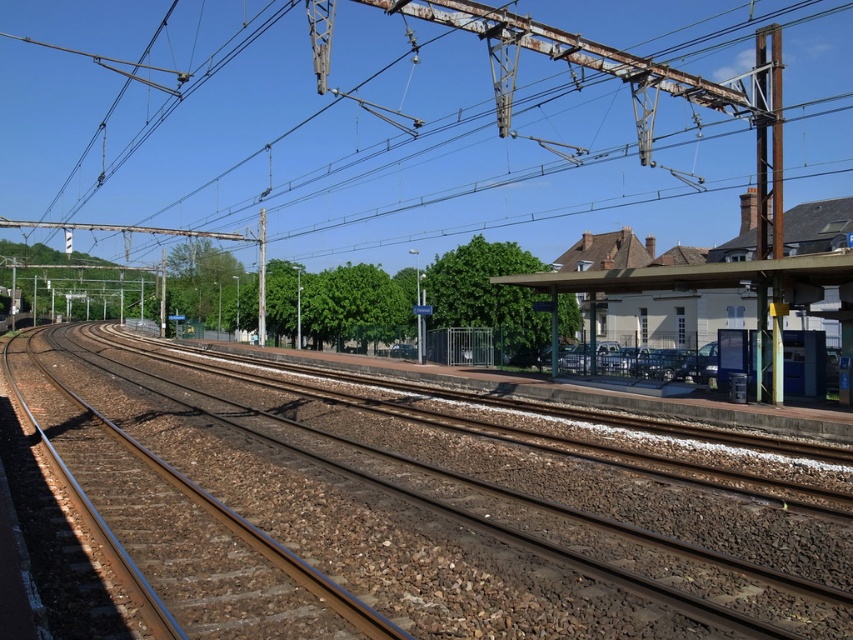
From the picture: You are a maintenance worker inspecting the railway station. You notice the rusty metal power lines at upper center and the brown gravel train track at center. Which object is positioned higher in the scene?

The rusty metal power lines at upper center are located above the brown gravel train track at center, so they are positioned higher in the scene.

You are a maintenance worker needing to inspect the rusty metal power lines at upper center. You are currently standing on the white painted platform at right. Given that your inspection equipment has a maximum reach of 70 meters, can you safely reach the power lines from your current position?

The rusty metal power lines at upper center are 76.58 meters away from the white painted platform at right. Since the equipment only reaches 70 meters, you cannot safely reach them from there.